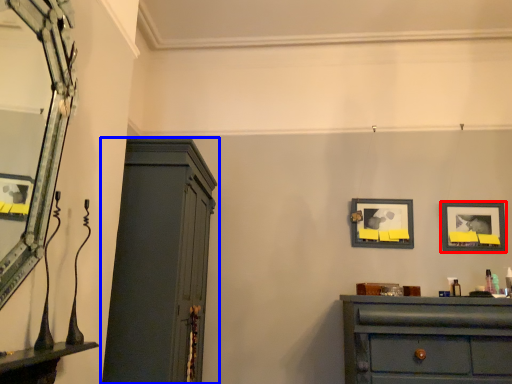
Question: Which of the following is the farthest to the observer, picture frame (highlighted by a red box) or cupboard (highlighted by a blue box)?

Choices:
 (A) picture frame
 (B) cupboard

Answer: (A)